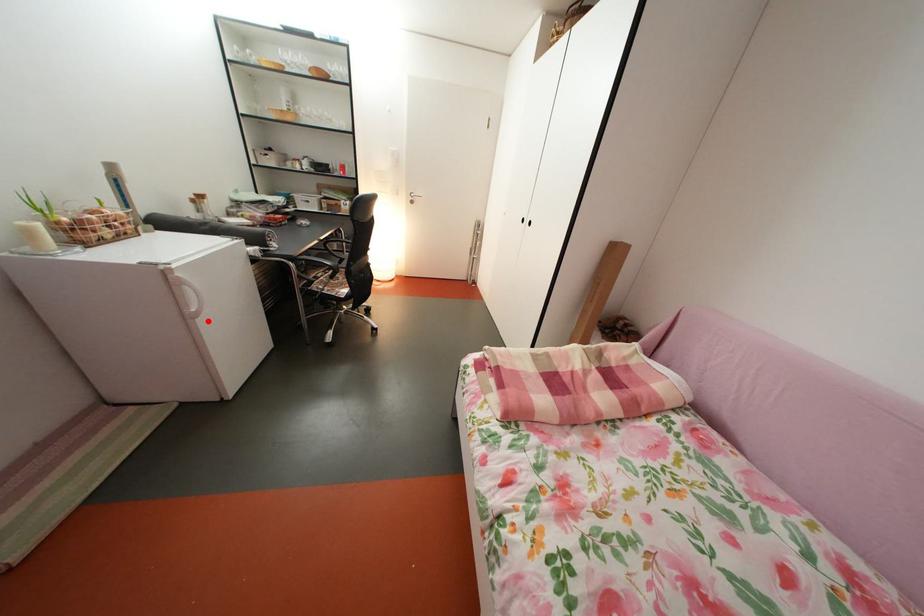
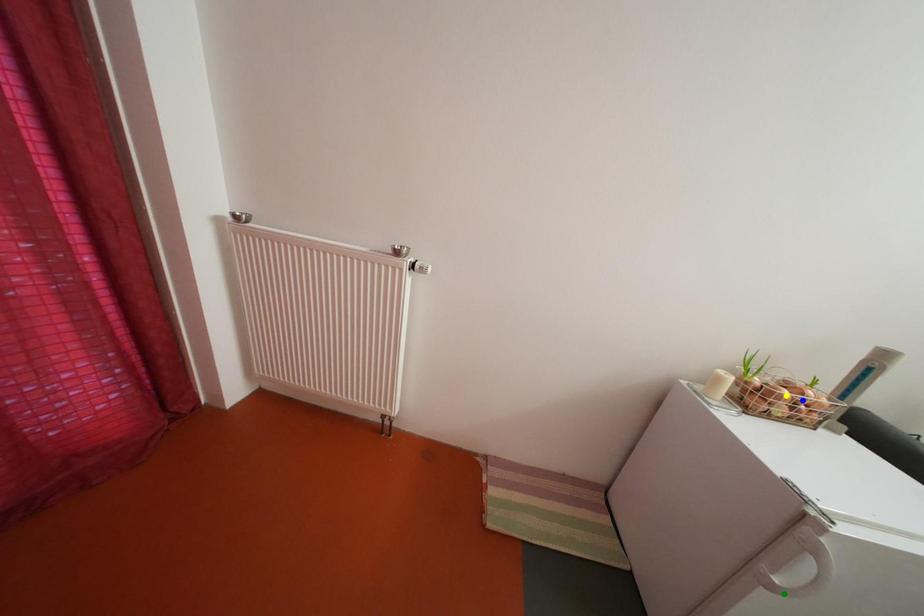
Question: I am providing you with two images of the same scene from different viewpoints. A red point is marked on the first image. You are given multiple points on the second image. Which mark in image 2 goes with the point in image 1?

Choices:
 (A) yellow point
 (B) blue point
 (C) green point

Answer: (C)